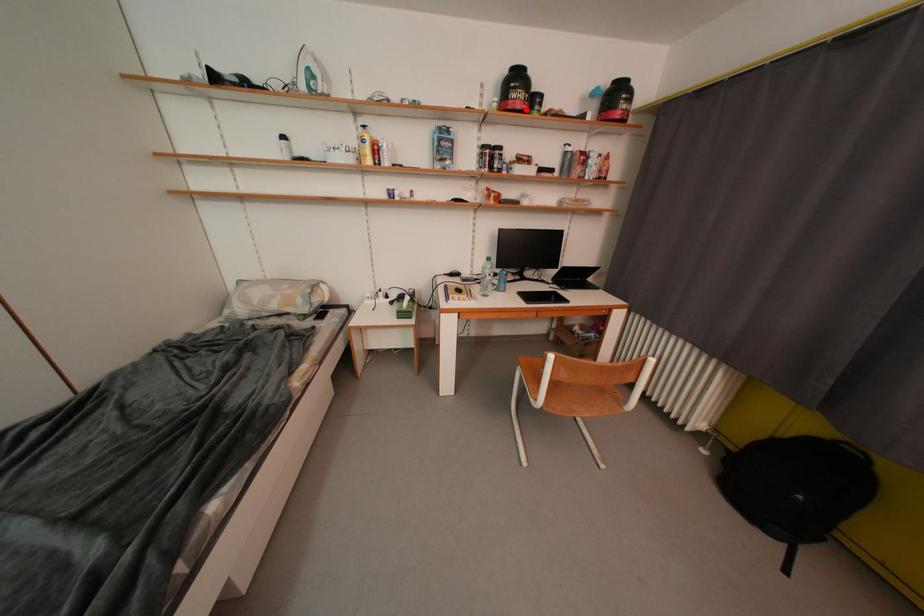
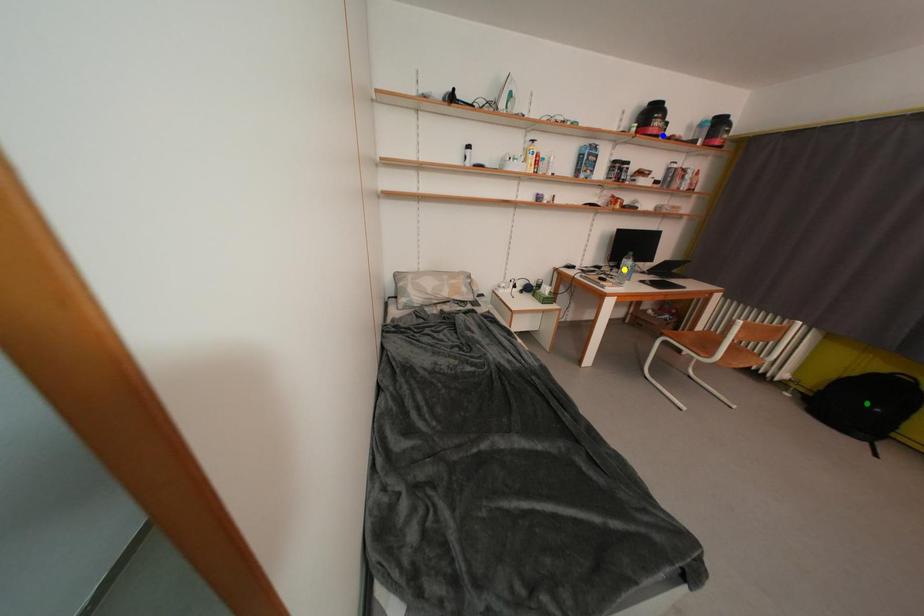
Question: I am providing you with two images of the same scene from different viewpoints. A red point is marked on the first image. You are given multiple points on the second image. Which mark in image 2 goes with the point in image 1?

Choices:
 (A) blue point
 (B) green point
 (C) yellow point

Answer: (A)